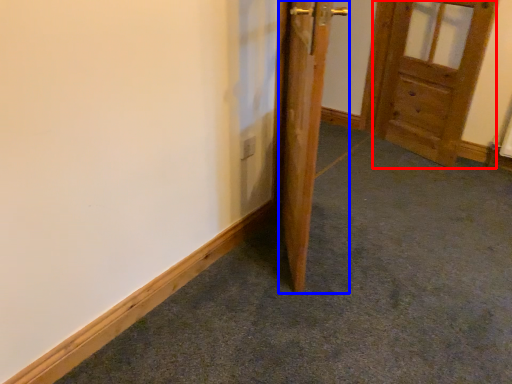
Question: Which object appears closest to the camera in this image, door (highlighted by a red box) or door (highlighted by a blue box)?

Choices:
 (A) door
 (B) door

Answer: (B)